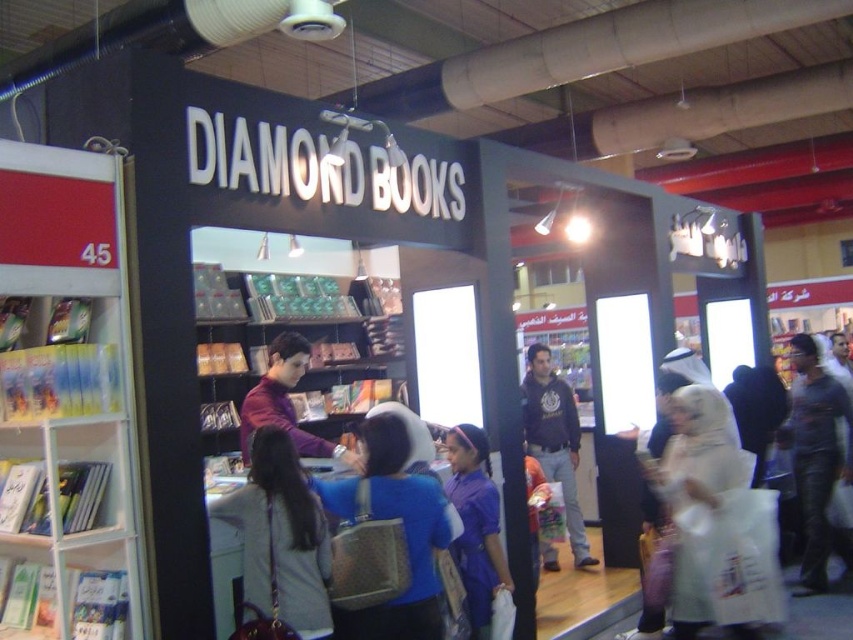
Based on the photo, measure the distance between leather jacket at center and dark blue hoodie at center.

5.42 feet

Looking at this image, who is more distant from viewer, (824, 461) or (575, 532)?

The point (575, 532) is behind.

Does point (807, 410) lie behind point (537, 355)?

No, (807, 410) is in front of (537, 355).

This screenshot has height=640, width=853. In order to click on leather jacket at center in this screenshot , I will do `click(816, 458)`.

Is white plastic bookshelf at left shorter than blue fabric backpack at center?

In fact, white plastic bookshelf at left may be taller than blue fabric backpack at center.

Who is higher up, white plastic bookshelf at left or blue fabric backpack at center?

Positioned higher is white plastic bookshelf at left.

This screenshot has height=640, width=853. What do you see at coordinates (65, 401) in the screenshot?
I see `white plastic bookshelf at left` at bounding box center [65, 401].

This screenshot has height=640, width=853. Find the location of `white plastic bookshelf at left`. white plastic bookshelf at left is located at coordinates (65, 401).

Is matte gray backpack at center to the right of leather jacket at center from the viewer's perspective?

No, matte gray backpack at center is not to the right of leather jacket at center.

Can you confirm if matte gray backpack at center is bigger than leather jacket at center?

No.

Is point (264, 444) positioned behind point (810, 522)?

No, it is in front of (810, 522).

Image resolution: width=853 pixels, height=640 pixels. I want to click on matte gray backpack at center, so click(x=280, y=536).